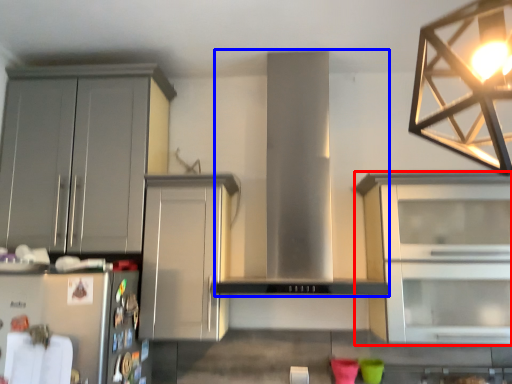
Question: Which object is further to the camera taking this photo, cabinetry (highlighted by a red box) or hood (highlighted by a blue box)?

Choices:
 (A) cabinetry
 (B) hood

Answer: (A)